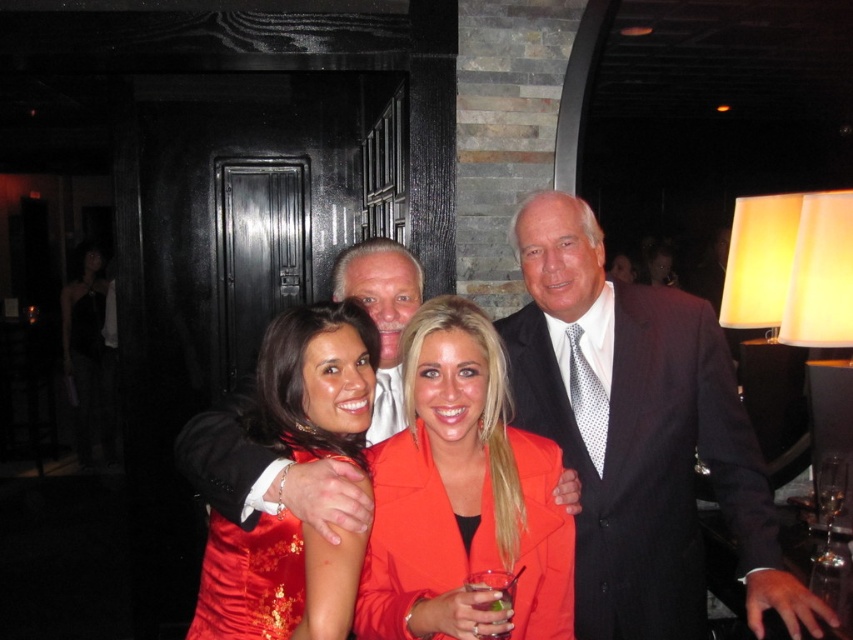
You are a photographer adjusting the camera focus. The scene has a satin red dress at center and a clear plastic glass at center. Which object should you focus on first if you want to capture the taller object in sharp detail?

The satin red dress at center is taller than the clear plastic glass at center, so you should focus on the satin red dress at center first to capture the taller object in sharp detail.

You are at a party and want to grab the clear glass wine glass at lower right without touching the orange satin jacket at center. Which direction should you move your hand relative to the jacket?

The orange satin jacket at center is to the left of the clear glass wine glass at lower right, so you should move your hand to the right of the orange satin jacket at center to reach the glass without touching it.

You are a photographer at a social event. You need to capture a closeup shot of the orange satin jacket at center and the clear glass wine glass at lower right. The camera can only focus on objects within 90 centimeters of each other. Will both items be in focus?

The orange satin jacket at center is 95.00 centimeters from the clear glass wine glass at lower right. Since the distance exceeds the 90 centimeter limit, the camera cannot focus on both items simultaneously.